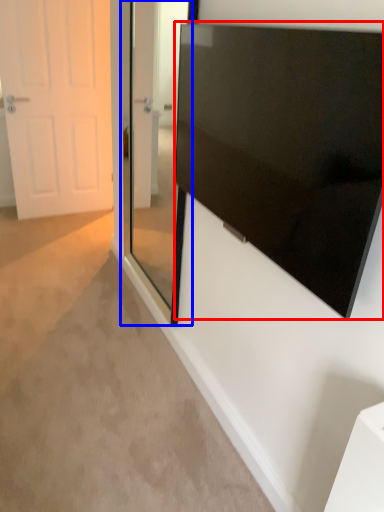
Question: Among these objects, which one is nearest to the camera, screen (highlighted by a red box) or glass door (highlighted by a blue box)?

Choices:
 (A) screen
 (B) glass door

Answer: (A)